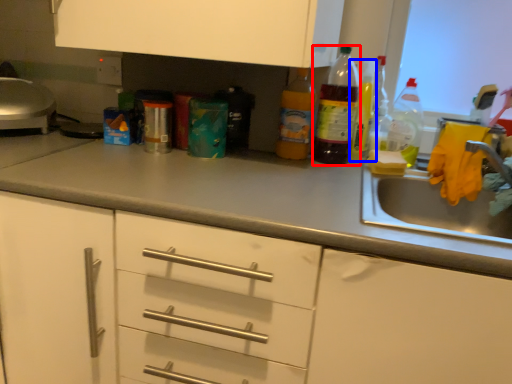
Question: Which point is further to the camera, bottle (highlighted by a red box) or bottle (highlighted by a blue box)?

Choices:
 (A) bottle
 (B) bottle

Answer: (B)